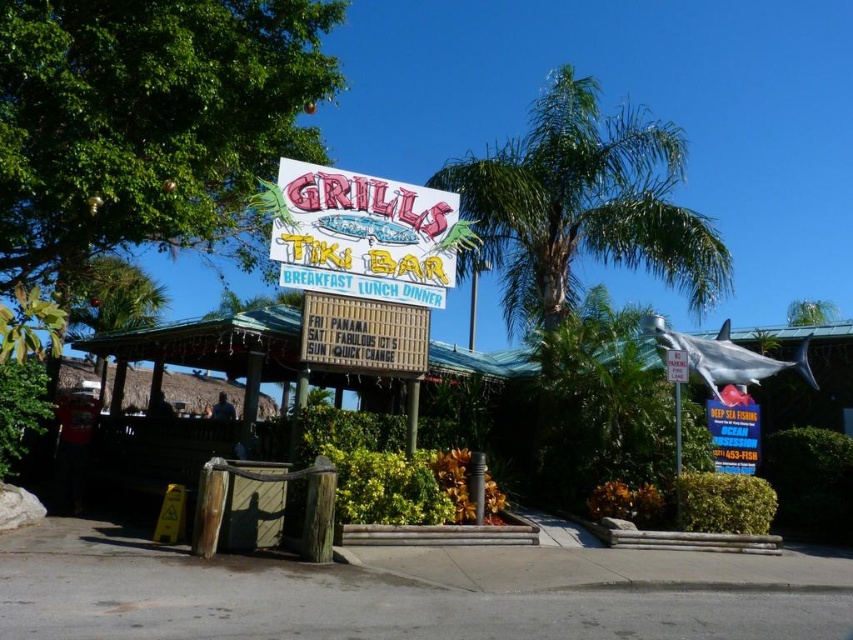
Between green leafy palm tree at center and wooden sign at center, which one appears on the right side from the viewer's perspective?

green leafy palm tree at center

Can you confirm if green leafy palm tree at center is taller than wooden sign at center?

Correct, green leafy palm tree at center is much taller as wooden sign at center.

This screenshot has height=640, width=853. Find the location of `green leafy palm tree at center`. green leafy palm tree at center is located at coordinates (582, 204).

Can you confirm if green leafy palm tree at center is wider than blue neon sign at upper right?

Correct, the width of green leafy palm tree at center exceeds that of blue neon sign at upper right.

Locate an element on the screen. The image size is (853, 640). green leafy palm tree at center is located at coordinates (582, 204).

Does white plastic signboard at center have a smaller size compared to white plastic sign at upper center?

No.

Between point (456, 211) and point (674, 371), which one is positioned behind?

The point (456, 211) is more distant.

Does point (288, 280) come farther from viewer compared to point (676, 365)?

That is False.

You are a GUI agent. You are given a task and a screenshot of the screen. Output one action in this format:
    pyautogui.click(x=<x>, y=<y>)
    Task: Click on the white plastic signboard at center
    
    Given the screenshot: What is the action you would take?
    pyautogui.click(x=363, y=234)